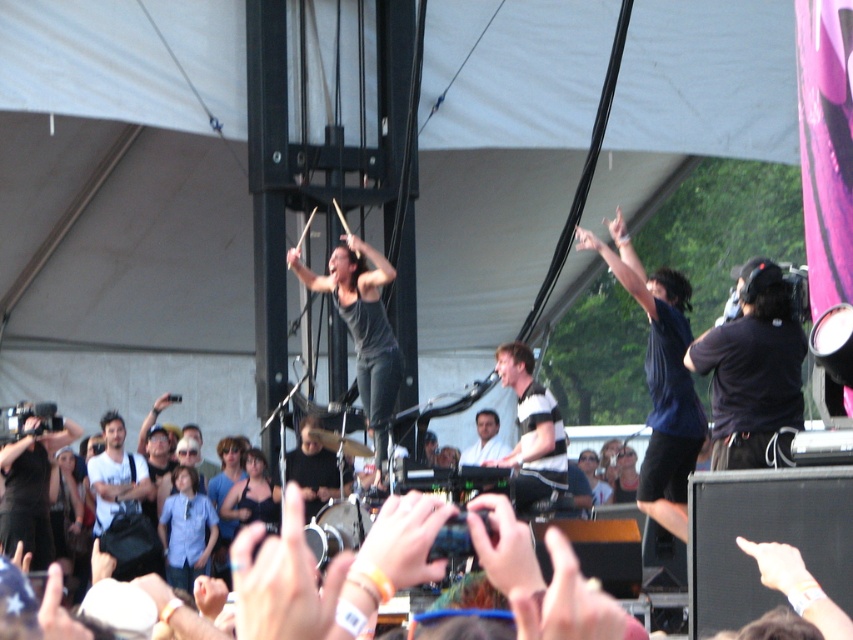
You are a photographer at the concert and need to decide which item to carry in your small bag. The bag can only fit items narrower than the blue shirt at lower left. Based on the scene, can you take the black camera at left?

The black camera at left has a width larger than the blue shirt at lower left, so it cannot fit in the bag. Choose a smaller item instead.

You are standing at the front of the concert, looking at the stage. There are two points marked on the stage. The first point is at coordinates point [32,508] and the second point is at point [169,515]. Which point is closer to you?

Point [32,508] is closer to the viewer than point [169,515].